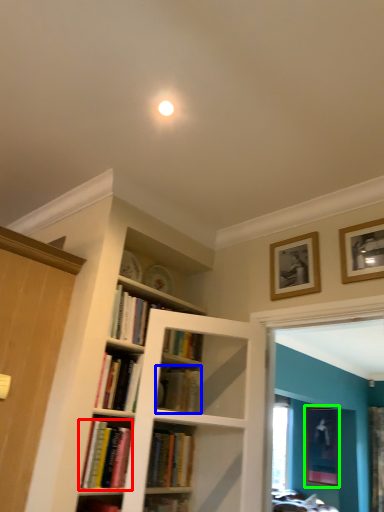
Question: Which is nearer to the book (highlighted by a red box)? book (highlighted by a blue box) or picture frame (highlighted by a green box).

Choices:
 (A) book
 (B) picture frame

Answer: (A)